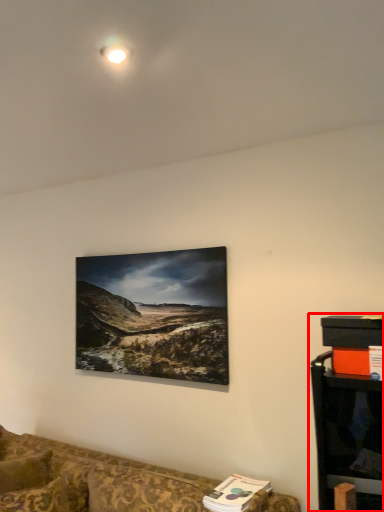
Question: From the image's perspective, what is the correct spatial positioning of entertainment center (annotated by the red box) in reference to studio couch?

Choices:
 (A) below
 (B) above

Answer: (B)